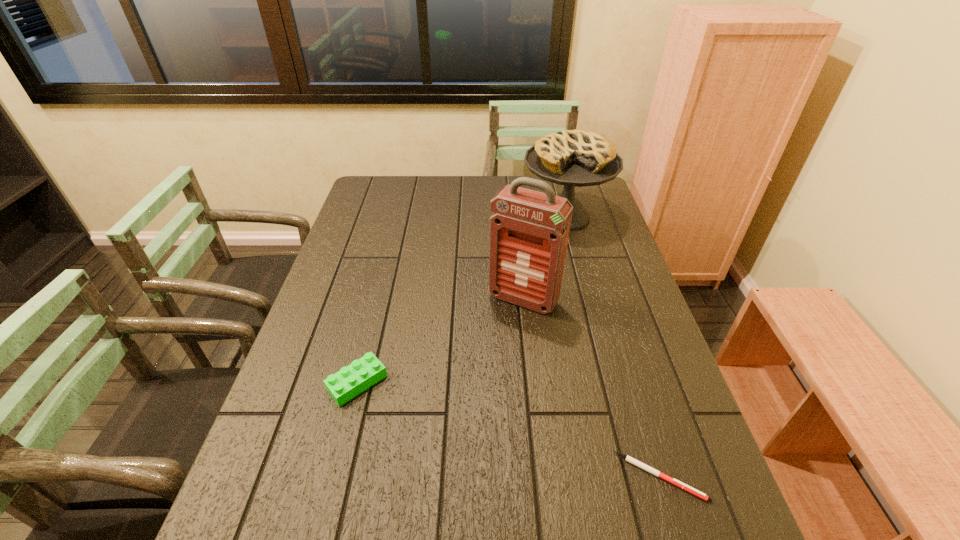
Identify the location of blank space that satisfies the following two spatial constraints: 1. on the front side of the pie; 2. on the clicker of the pen. (633, 477).